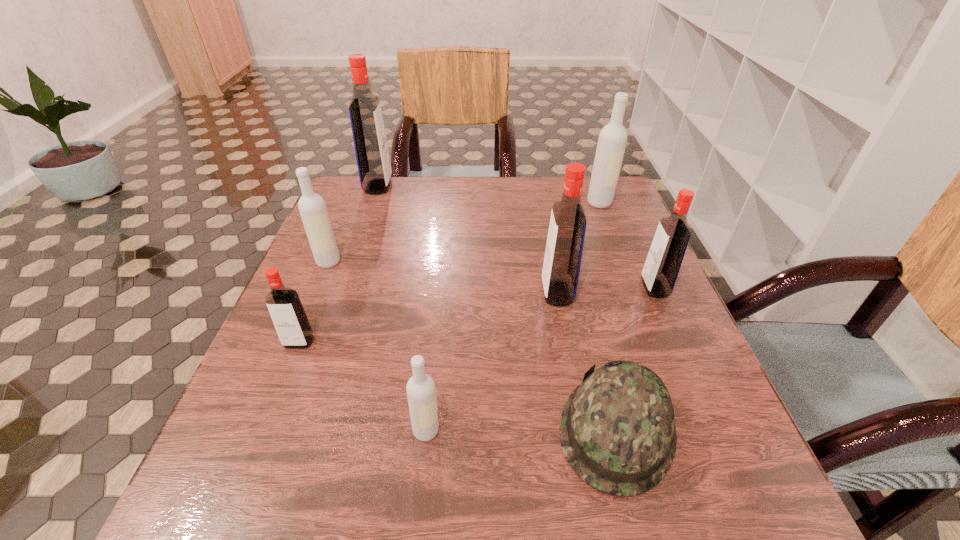
You are a GUI agent. You are given a task and a screenshot of the screen. Output one action in this format:
    pyautogui.click(x=<x>, y=<y>)
    Task: Click on the vacant region located on the front and back of the rightmost red vodka
    
    Given the screenshot: What is the action you would take?
    pyautogui.click(x=547, y=288)

Identify the location of free region located 0.210m on the front and back of the rightmost red vodka. (547, 288).

Where is `vacant position located on the front and back of the rightmost red vodka`? vacant position located on the front and back of the rightmost red vodka is located at coordinates (461, 288).

The image size is (960, 540). What are the coordinates of `free space located on the front and back of the sixth farthest object` in the screenshot? It's located at coord(276,400).

Where is `vacant space situated 0.050m on the left of the nearest white vodka`? The height and width of the screenshot is (540, 960). vacant space situated 0.050m on the left of the nearest white vodka is located at coordinates coord(382,430).

Image resolution: width=960 pixels, height=540 pixels. What are the coordinates of `vacant space situated 0.220m on the left of the shortest object` in the screenshot? It's located at (422, 430).

Find the location of `object that is at the near edge`. object that is at the near edge is located at coordinates (617, 430).

This screenshot has width=960, height=540. Identify the location of headwear present at the right edge. (617, 430).

Find the location of a particular element. The image size is (960, 540). object that is at the far left corner is located at coordinates (372, 155).

At what (x,y) coordinates should I click in order to perform the action: click on object present at the far right corner. Please return your answer as a coordinate pair (x, y). This screenshot has height=540, width=960. Looking at the image, I should click on (612, 140).